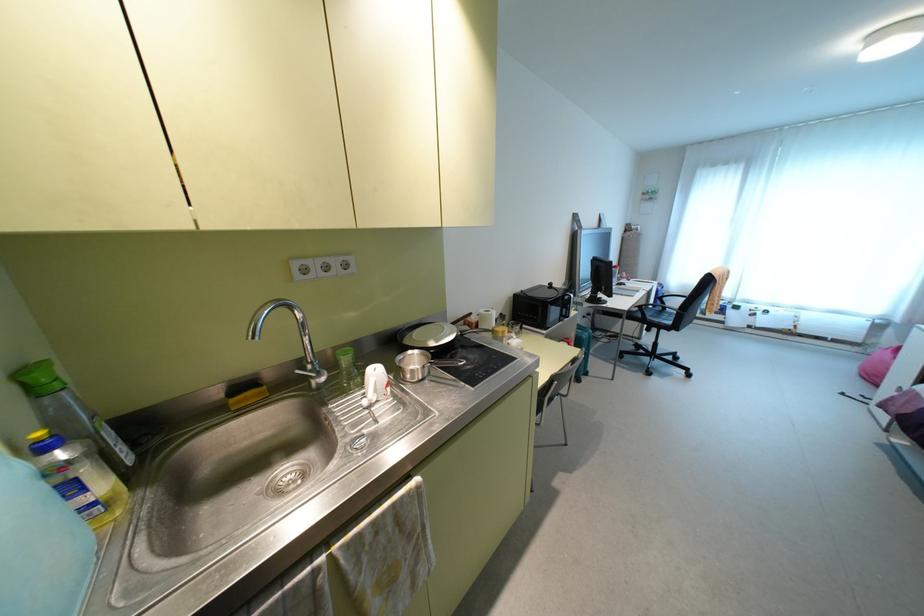
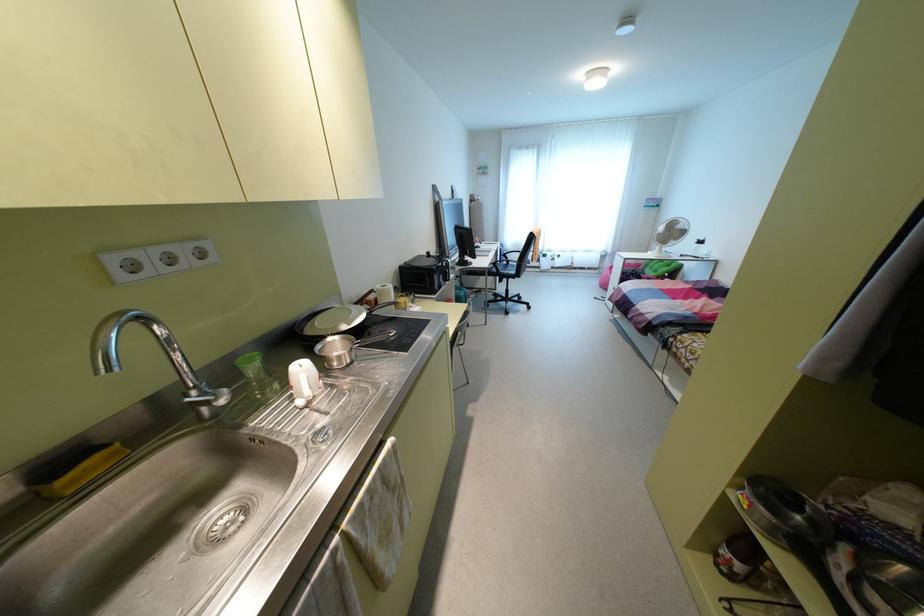
In the second image, find the point that corresponds to [667,322] in the first image.

(513, 272)